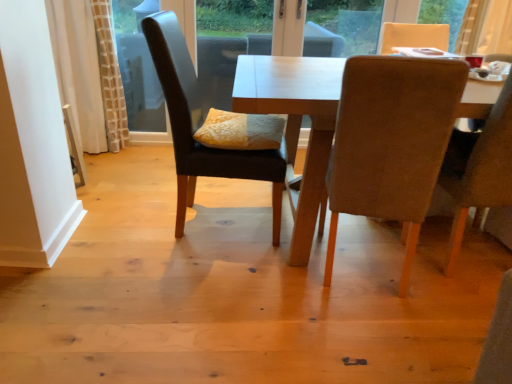
The width and height of the screenshot is (512, 384). Identify the location of space that is in front of velvet beige chair at right, which is the 2th chair in right-to-left order. (385, 338).